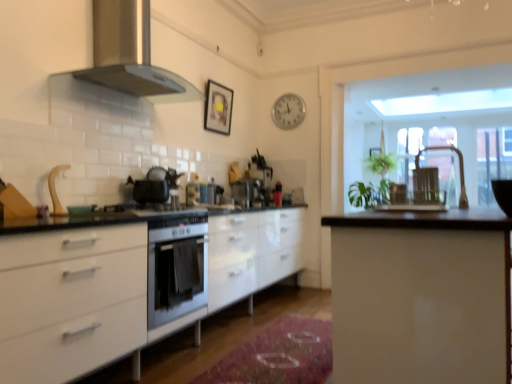
Question: Is matte black kettle at right, the first appliance in the right-to-left sequence, positioned beyond the bounds of satin black coffee machine at center, positioned as the second coffee machine in front-to-back order?

Choices:
 (A) no
 (B) yes

Answer: (B)

Question: Does matte black kettle at right, which is counted as the second appliance, starting from the back, lie in front of satin black coffee machine at center, which is the 1th coffee machine from back to front?

Choices:
 (A) yes
 (B) no

Answer: (A)

Question: Is matte black kettle at right, placed as the 2th appliance when sorted from left to right, aimed at satin black coffee machine at center, which is the 1th coffee machine from back to front?

Choices:
 (A) yes
 (B) no

Answer: (B)

Question: Can you confirm if matte black kettle at right, placed as the 2th appliance when sorted from left to right, is positioned to the right of satin black coffee machine at center, positioned as the second coffee machine in front-to-back order?

Choices:
 (A) no
 (B) yes

Answer: (B)

Question: From the image's perspective, does matte black kettle at right, the first appliance in the right-to-left sequence, appear higher than satin black coffee machine at center, positioned as the second coffee machine in front-to-back order?

Choices:
 (A) no
 (B) yes

Answer: (A)

Question: In terms of width, does white glossy cabinets at center, which appears as the 1th cabinetry when viewed from the left, look wider or thinner when compared to matte black gas stove at center?

Choices:
 (A) thin
 (B) wide

Answer: (B)

Question: In the image, is white glossy cabinets at center, arranged as the 2th cabinetry when viewed from the right, positioned in front of or behind matte black gas stove at center?

Choices:
 (A) behind
 (B) front

Answer: (B)

Question: From a real-world perspective, is white glossy cabinets at center, arranged as the 2th cabinetry when viewed from the right, above or below matte black gas stove at center?

Choices:
 (A) above
 (B) below

Answer: (B)

Question: From their relative heights in the image, would you say white glossy cabinets at center, arranged as the 2th cabinetry when viewed from the right, is taller or shorter than matte black gas stove at center?

Choices:
 (A) tall
 (B) short

Answer: (A)

Question: From the image's perspective, is metallic silver chair at right located above or below clear glass door at upper right?

Choices:
 (A) below
 (B) above

Answer: (A)

Question: Which is correct: metallic silver chair at right is inside clear glass door at upper right, or outside of it?

Choices:
 (A) outside
 (B) inside

Answer: (A)

Question: From a real-world perspective, relative to clear glass door at upper right, is metallic silver chair at right vertically above or below?

Choices:
 (A) below
 (B) above

Answer: (A)

Question: Based on their sizes in the image, would you say metallic silver chair at right is bigger or smaller than clear glass door at upper right?

Choices:
 (A) big
 (B) small

Answer: (B)

Question: Looking at their shapes, would you say satin silver coffee machine at center, the first coffee machine from the front, is wider or thinner than metallic silver chair at right?

Choices:
 (A) wide
 (B) thin

Answer: (A)

Question: Considering the positions of satin silver coffee machine at center, the first coffee machine from the front, and metallic silver chair at right in the image, is satin silver coffee machine at center, the first coffee machine from the front, taller or shorter than metallic silver chair at right?

Choices:
 (A) tall
 (B) short

Answer: (A)